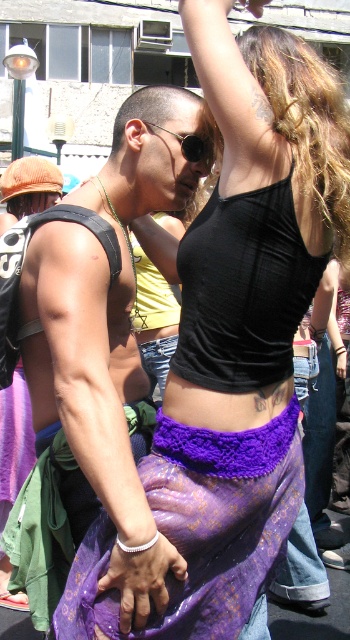
Can you confirm if matte black tank top at upper center is positioned to the right of sunglasses at center?

In fact, matte black tank top at upper center is to the left of sunglasses at center.

Is point (66, 292) farther from camera compared to point (184, 148)?

No, (66, 292) is in front of (184, 148).

Where is `matte black tank top at upper center`? This screenshot has width=350, height=640. matte black tank top at upper center is located at coordinates (x=92, y=362).

Does black ribbed tank top at center have a larger size compared to sunglasses at center?

Yes, black ribbed tank top at center is bigger than sunglasses at center.

Which of these two, black ribbed tank top at center or sunglasses at center, stands shorter?

sunglasses at center

You are a GUI agent. You are given a task and a screenshot of the screen. Output one action in this format:
    pyautogui.click(x=<x>, y=<y>)
    Task: Click on the black ribbed tank top at center
    
    Given the screenshot: What is the action you would take?
    pyautogui.click(x=242, y=291)

Who is positioned more to the left, matte black tank top at upper center or purple crochet belt at center?

matte black tank top at upper center

At what (x,y) coordinates should I click in order to perform the action: click on matte black tank top at upper center. Please return your answer as a coordinate pair (x, y). This screenshot has width=350, height=640. Looking at the image, I should click on (92, 362).

Does point (145, 506) come closer to viewer compared to point (150, 531)?

No, (145, 506) is further to viewer.

The height and width of the screenshot is (640, 350). In order to click on matte black tank top at upper center in this screenshot , I will do `click(92, 362)`.